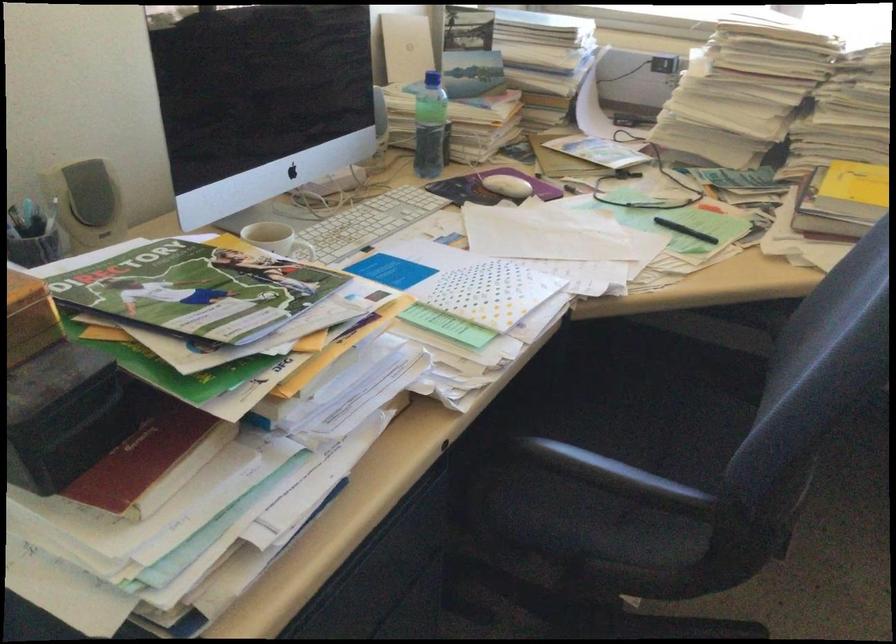
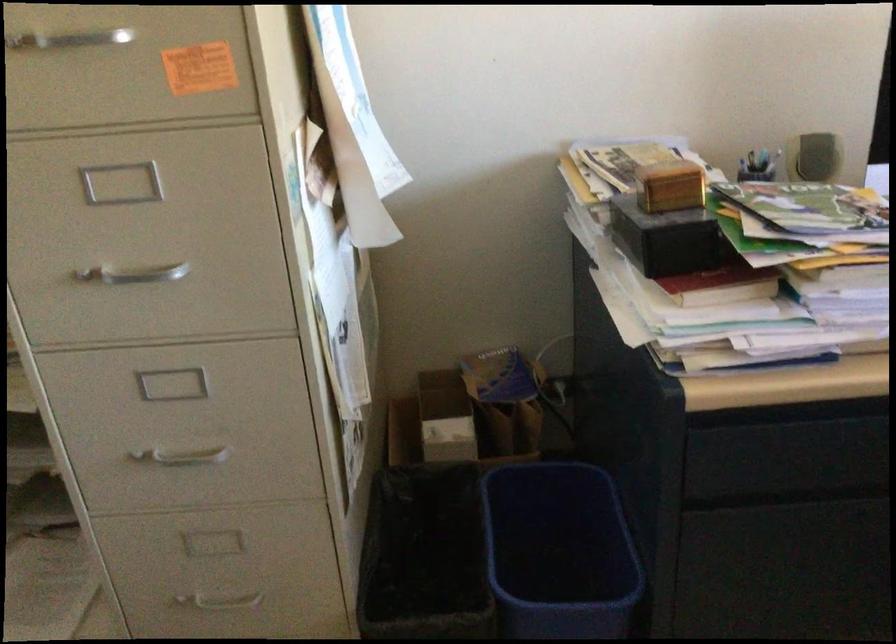
Question: The camera is either moving clockwise (left) or counter-clockwise (right) around the object. The first image is from the beginning of the video and the second image is from the end. Is the camera moving left or right when shooting the video?

Choices:
 (A) Left
 (B) Right

Answer: (B)